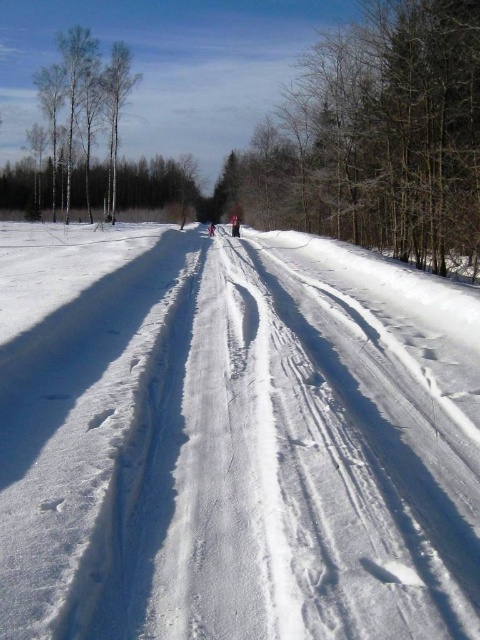
Question: Which object appears farthest from the camera in this image?

Choices:
 (A) red woolen hat at center
 (B) white bark trees at left

Answer: (B)

Question: Does white bark trees at left lie behind red woolen hat at center?

Choices:
 (A) no
 (B) yes

Answer: (B)

Question: Which object is farther from the camera taking this photo?

Choices:
 (A) red woolen hat at center
 (B) white bark trees at left

Answer: (B)

Question: Which point appears farthest from the camera in this image?

Choices:
 (A) (84, 72)
 (B) (237, 216)

Answer: (B)

Question: Where is white bark trees at left located in relation to red woolen hat at center in the image?

Choices:
 (A) right
 (B) left

Answer: (B)

Question: Can you confirm if white bark trees at left is positioned to the left of red woolen hat at center?

Choices:
 (A) no
 (B) yes

Answer: (B)